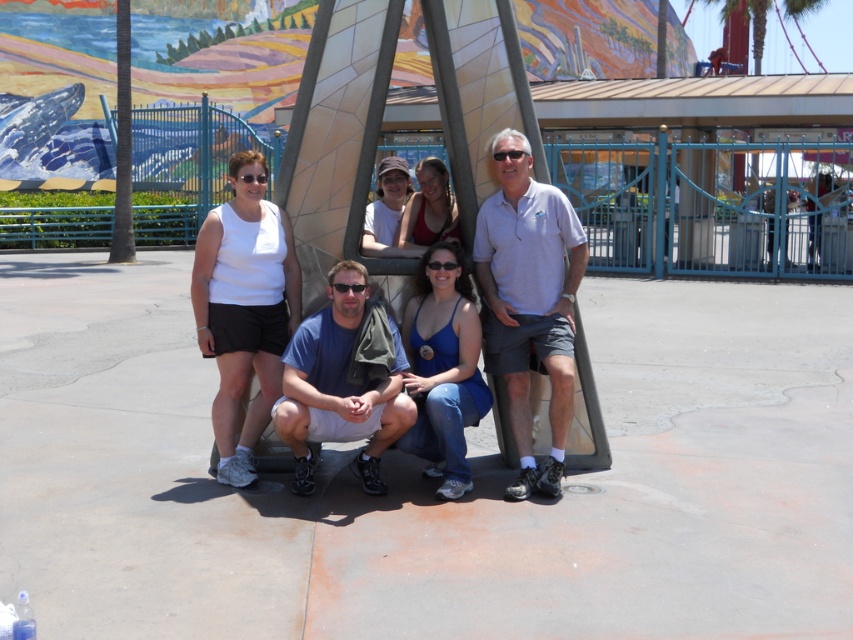
Which of these two, gray cotton polo shirt at center or matte white shirt at center, stands shorter?

With less height is matte white shirt at center.

Between gray cotton polo shirt at center and matte white shirt at center, which one appears on the right side from the viewer's perspective?

From the viewer's perspective, gray cotton polo shirt at center appears more on the right side.

Who is more forward, (x=553, y=310) or (x=399, y=252)?

Point (x=553, y=310)

Find the location of a particular element. This screenshot has height=640, width=853. gray cotton polo shirt at center is located at coordinates (529, 300).

The image size is (853, 640). Identify the location of matte white tank top at center. (496, 324).

Is point (538, 476) farther from camera compared to point (334, 365)?

Yes, point (538, 476) is behind point (334, 365).

At what (x,y) coordinates should I click in order to perform the action: click on matte white tank top at center. Please return your answer as a coordinate pair (x, y). Looking at the image, I should click on (496, 324).

Find the location of a particular element. The height and width of the screenshot is (640, 853). matte white tank top at center is located at coordinates (496, 324).

Who is lower down, matte white tank top at center or matte white shirt at center?

matte white tank top at center

In the scene shown: Does matte white tank top at center lie behind matte white shirt at center?

No, matte white tank top at center is closer to the viewer.

Is point (460, 288) positioned after point (387, 163)?

No, (460, 288) is closer to viewer.

Where is `matte white tank top at center`? matte white tank top at center is located at coordinates (496, 324).